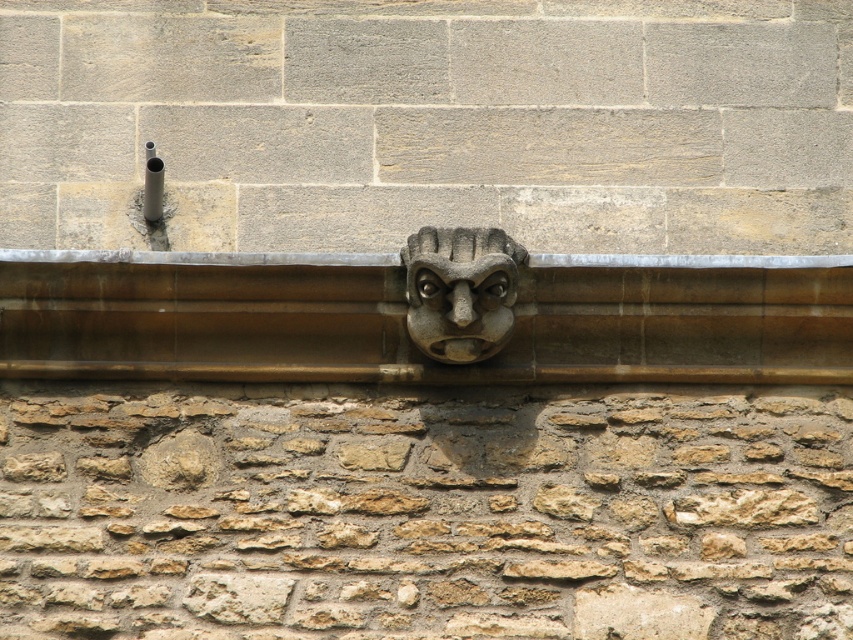
Question: Which point is closer to the camera?

Choices:
 (A) (498, 336)
 (B) (218, 403)
 (C) (384, 342)

Answer: (A)

Question: Is brown rough stone at center further to camera compared to stone carved face at center?

Choices:
 (A) yes
 (B) no

Answer: (B)

Question: Among these points, which one is farthest from the camera?

Choices:
 (A) (428, 280)
 (B) (846, 260)

Answer: (B)

Question: Is brown rough stone at center positioned before stone carved face at center?

Choices:
 (A) no
 (B) yes

Answer: (B)

Question: Which point is closer to the camera taking this photo?

Choices:
 (A) (427, 320)
 (B) (666, 378)

Answer: (A)

Question: Is brown rough stone at center wider than stone carved face at center?

Choices:
 (A) yes
 (B) no

Answer: (A)